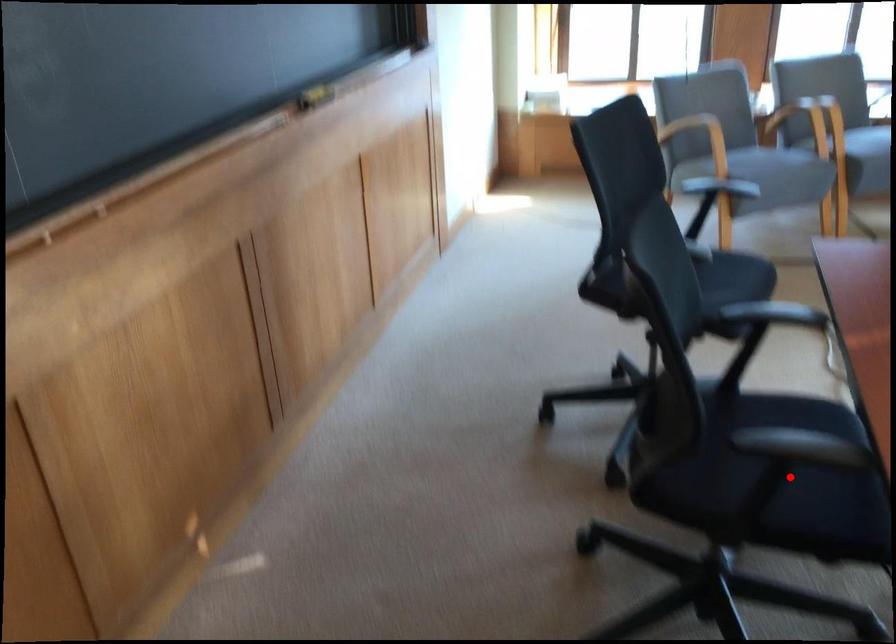
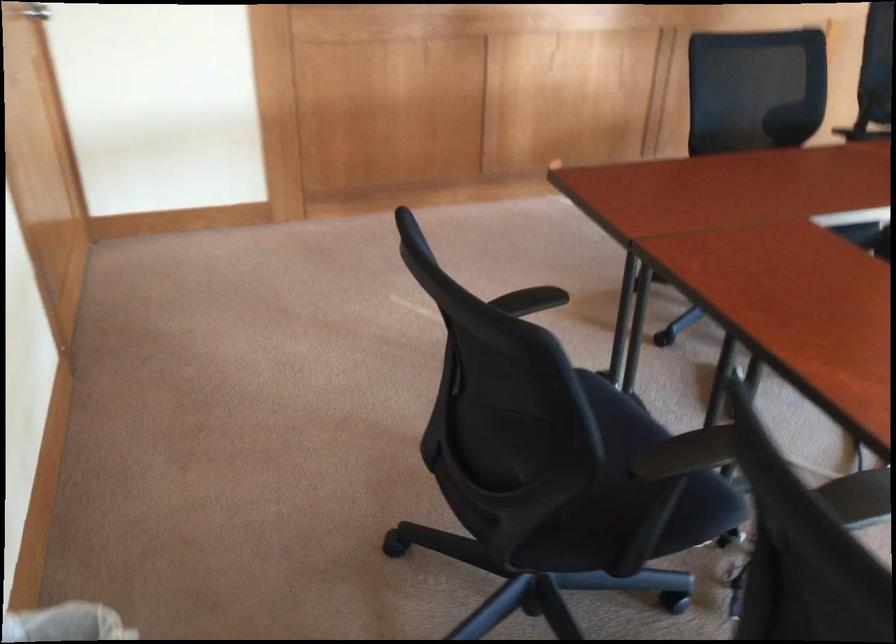
Question: I am providing you with two images of the same scene from different viewpoints. A red point is marked on the first image. Can you still see the location of the red point in image 2?

Choices:
 (A) Yes
 (B) No

Answer: (B)